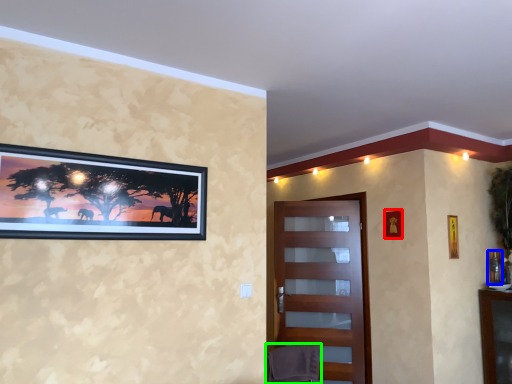
Question: Which object is positioned farthest from picture frame (highlighted by a red box)? Select from picture frame (highlighted by a blue box) and swivel chair (highlighted by a green box).

Choices:
 (A) picture frame
 (B) swivel chair

Answer: (B)